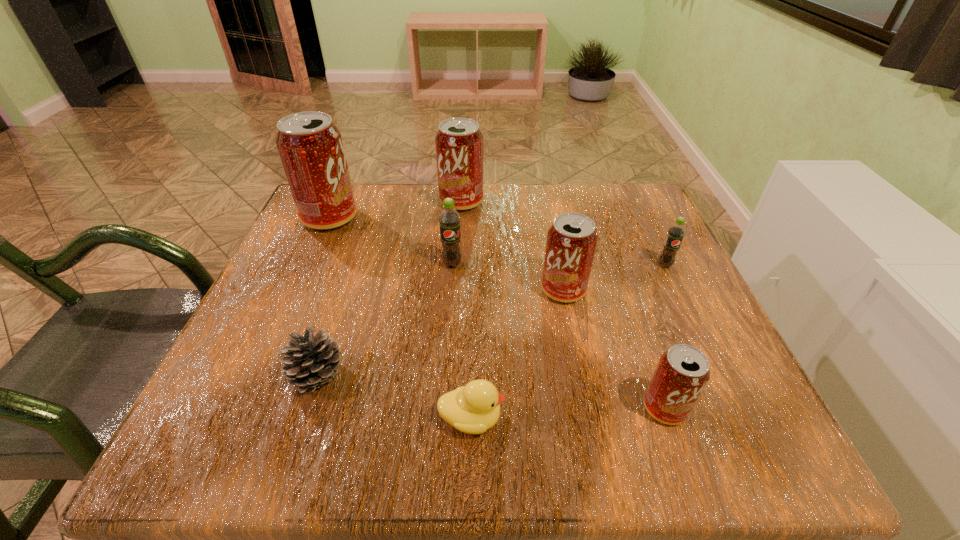
At what (x,y) coordinates should I click in order to perform the action: click on free spot between the third red soda can from right to left and the tallest object. Please return your answer as a coordinate pair (x, y). Looking at the image, I should click on (396, 210).

The width and height of the screenshot is (960, 540). Identify the location of free space between the second soda can from right to left and the bigger green soda. (559, 336).

The height and width of the screenshot is (540, 960). Identify the location of unoccupied area between the seventh tallest object and the left green soda. click(x=385, y=320).

Point out which object is positioned as the nearest to the third red soda can from left to right. Please provide its 2D coordinates. Your answer should be formatted as a tuple, i.e. [(x, y)], where the tuple contains the x and y coordinates of a point satisfying the conditions above.

[(449, 219)]

The height and width of the screenshot is (540, 960). I want to click on the second closest object to the pinecone, so click(449, 219).

You are a GUI agent. You are given a task and a screenshot of the screen. Output one action in this format:
    pyautogui.click(x=<x>, y=<y>)
    Task: Click on the soda can that stands as the fifth closest to the pinecone
    
    Given the screenshot: What is the action you would take?
    pyautogui.click(x=682, y=372)

At what (x,y) coordinates should I click in order to perform the action: click on the third closest soda can relative to the rightmost soda can. Please return your answer as a coordinate pair (x, y). The height and width of the screenshot is (540, 960). Looking at the image, I should click on (459, 143).

This screenshot has height=540, width=960. Identify the location of red soda can that is the second closest to the second object from right to left. (459, 143).

Point out which red soda can is positioned as the third nearest to the pinecone. Please provide its 2D coordinates. Your answer should be formatted as a tuple, i.e. [(x, y)], where the tuple contains the x and y coordinates of a point satisfying the conditions above.

[(459, 143)]

This screenshot has height=540, width=960. In order to click on vacant area that satisfies the following two spatial constraints: 1. on the front label of the fourth nearest object; 2. on the left side of the left green soda in this screenshot , I will do `click(450, 290)`.